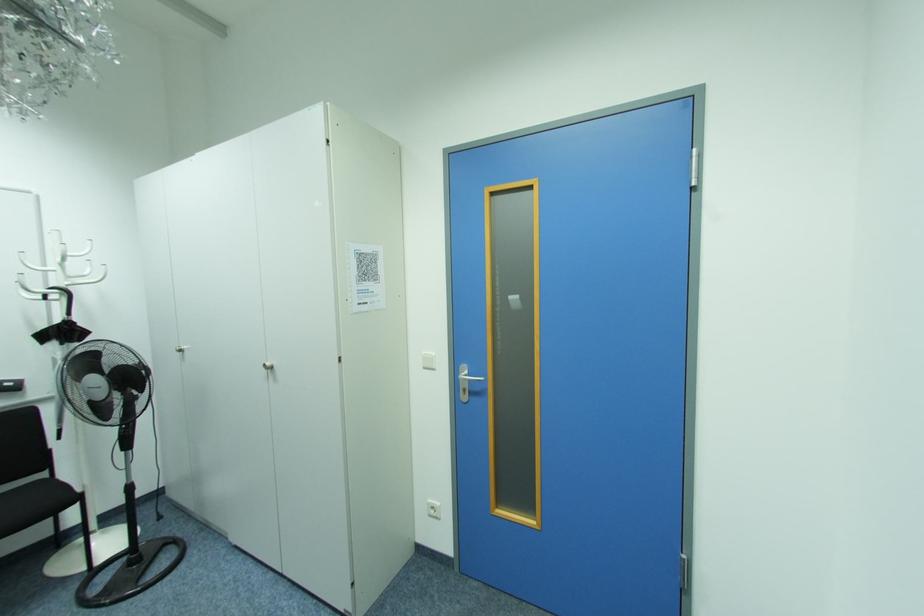
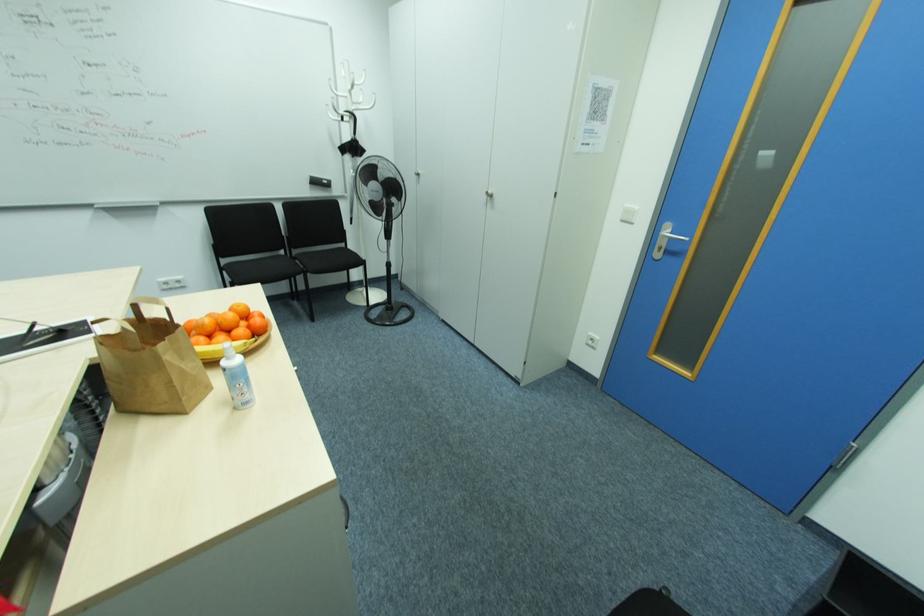
First-person continuous shooting, in which direction is the camera rotating?

The camera rotated toward left-down.